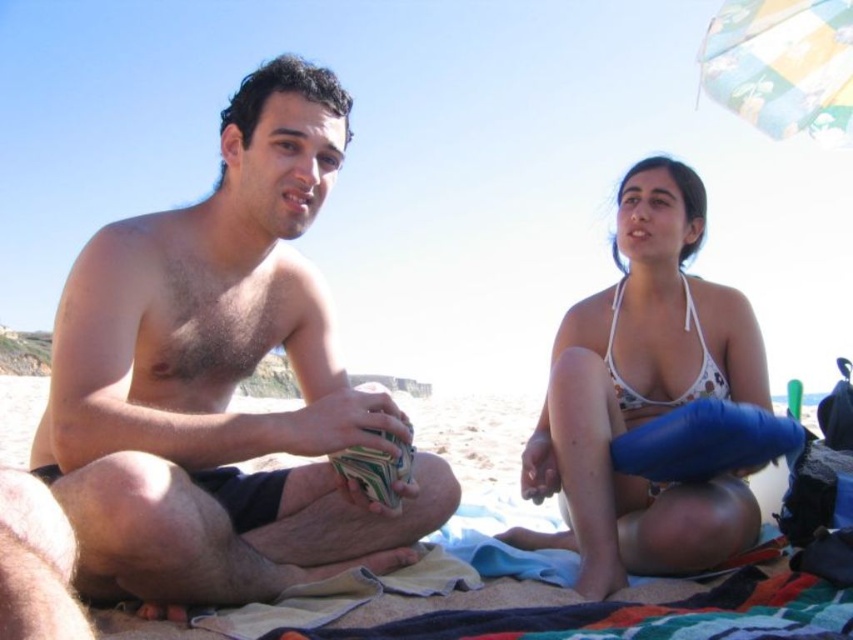
Consider the image. Between white bikini top at center and multicolored fabric umbrella at upper right, which one is positioned lower?

Positioned lower is white bikini top at center.

The width and height of the screenshot is (853, 640). What do you see at coordinates (643, 396) in the screenshot?
I see `white bikini top at center` at bounding box center [643, 396].

Where is `white bikini top at center`? The height and width of the screenshot is (640, 853). white bikini top at center is located at coordinates (643, 396).

Does hairless skin at center lie in front of white bikini top at center?

Yes.

Identify the location of hairless skin at center. (221, 381).

Does white bikini top at center appear on the left side of white floral bikini top at upper right?

Correct, you'll find white bikini top at center to the left of white floral bikini top at upper right.

Is white bikini top at center shorter than white floral bikini top at upper right?

No, white bikini top at center is not shorter than white floral bikini top at upper right.

This screenshot has height=640, width=853. In order to click on white bikini top at center in this screenshot , I will do `click(643, 396)`.

The height and width of the screenshot is (640, 853). Find the location of `white bikini top at center`. white bikini top at center is located at coordinates (643, 396).